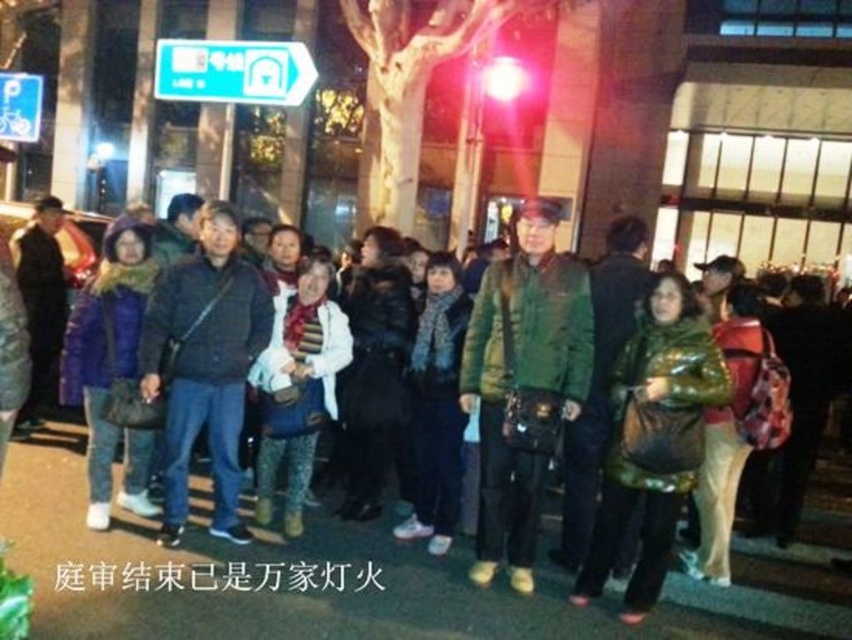
Question: Where is green matte jacket at center located in relation to green plastic sign at upper left in the image?

Choices:
 (A) left
 (B) right

Answer: (B)

Question: Which object is closer to the camera taking this photo?

Choices:
 (A) dark blue jeans at center
 (B) green quilted jacket at center
 (C) green matte jacket at center
 (D) green plastic sign at upper left

Answer: (C)

Question: Does green matte jacket at center appear under green plastic sign at upper left?

Choices:
 (A) no
 (B) yes

Answer: (B)

Question: Based on their relative distances, which object is nearer to the green quilted jacket at center?

Choices:
 (A) dark blue jeans at center
 (B) green matte jacket at center

Answer: (A)

Question: Which point is closer to the camera?

Choices:
 (A) (232, 230)
 (B) (786, 624)

Answer: (B)

Question: Is green quilted jacket at center below dark blue jeans at center?

Choices:
 (A) no
 (B) yes

Answer: (B)